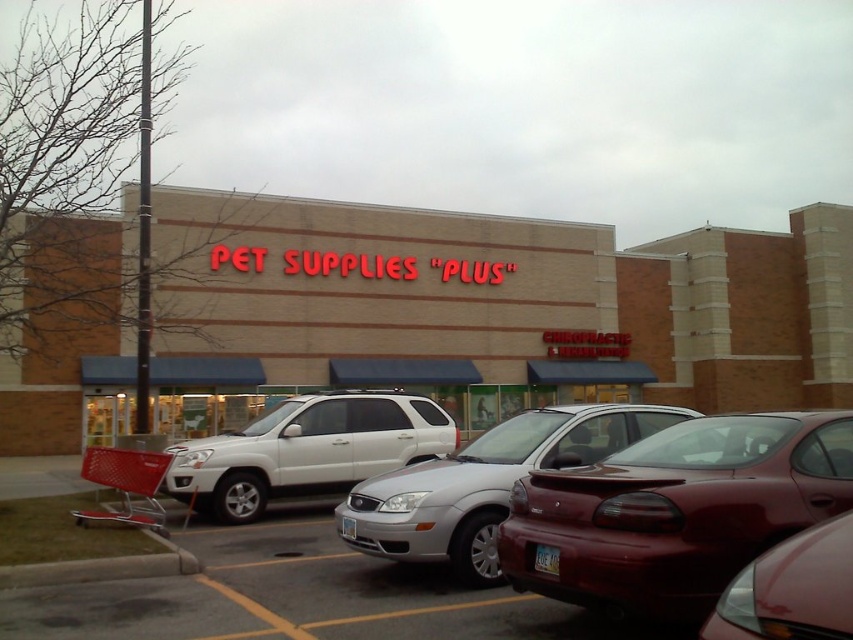
You are a delivery driver with a 12ft long truck. You need to park your truck in the parking lot where the white matte suv at center and red plastic shopping cart at lower left are located. Can you fit your truck between these two objects without overlapping them?

The white matte suv at center is larger than the red plastic shopping cart at lower left. However, the exact distance between them is not provided in the scene description. Therefore, it is uncertain whether the 12ft truck can fit between them without overlapping.

You are a delivery driver who needs to park your truck, which is 6 meters long, in the parking lot. The parking spots are 5 meters long. You see the silver metallic sedan at center and the white matte suv at center. Which vehicle should you avoid parking next to to ensure enough space?

The silver metallic sedan at center is smaller than the white matte suv at center. You should avoid parking next to the white matte suv at center because it is larger and may take up more space, leaving less room for your truck.